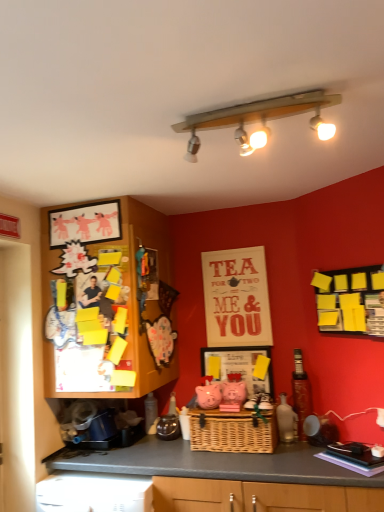
Question: From the image's perspective, is shiny metallic bottle at right beneath wooden picture frame at upper left, the 1th picture frame from the left?

Choices:
 (A) no
 (B) yes

Answer: (B)

Question: Is shiny metallic bottle at right completely or partially outside of wooden picture frame at upper left, which appears as the 1th picture frame when viewed from the top?

Choices:
 (A) yes
 (B) no

Answer: (A)

Question: Is shiny metallic bottle at right facing towards wooden picture frame at upper left, which appears as the 1th picture frame when viewed from the top?

Choices:
 (A) yes
 (B) no

Answer: (B)

Question: Is shiny metallic bottle at right placed right next to wooden picture frame at upper left, the 1th picture frame from the left?

Choices:
 (A) no
 (B) yes

Answer: (A)

Question: Is shiny metallic bottle at right further to the viewer compared to wooden picture frame at upper left, which is the 2th picture frame from bottom to top?

Choices:
 (A) yes
 (B) no

Answer: (A)

Question: Looking at their shapes, would you say matte white picture frame at center, which ranks as the 2th picture frame in top-to-bottom order, is wider or thinner than wooden with frosted glass lights at upper center?

Choices:
 (A) thin
 (B) wide

Answer: (A)

Question: In the image, is matte white picture frame at center, which ranks as the 2th picture frame in top-to-bottom order, on the left side or the right side of wooden with frosted glass lights at upper center?

Choices:
 (A) right
 (B) left

Answer: (A)

Question: Considering their positions, is matte white picture frame at center, which ranks as the 2th picture frame in top-to-bottom order, located in front of or behind wooden with frosted glass lights at upper center?

Choices:
 (A) behind
 (B) front

Answer: (A)

Question: Based on their sizes in the image, would you say matte white picture frame at center, which ranks as the 2th picture frame in top-to-bottom order, is bigger or smaller than wooden with frosted glass lights at upper center?

Choices:
 (A) big
 (B) small

Answer: (B)

Question: In terms of height, does woven brown basket at center look taller or shorter compared to shiny metallic bottle at right?

Choices:
 (A) tall
 (B) short

Answer: (B)

Question: In the image, is woven brown basket at center positioned in front of or behind shiny metallic bottle at right?

Choices:
 (A) behind
 (B) front

Answer: (B)

Question: In terms of width, does woven brown basket at center look wider or thinner when compared to shiny metallic bottle at right?

Choices:
 (A) thin
 (B) wide

Answer: (B)

Question: In the image, is woven brown basket at center on the left side or the right side of shiny metallic bottle at right?

Choices:
 (A) left
 (B) right

Answer: (A)

Question: Choose the correct answer: Is wooden with frosted glass lights at upper center inside yellow sticky notes at upper right or outside it?

Choices:
 (A) inside
 (B) outside

Answer: (B)

Question: Is wooden with frosted glass lights at upper center bigger or smaller than yellow sticky notes at upper right?

Choices:
 (A) small
 (B) big

Answer: (B)